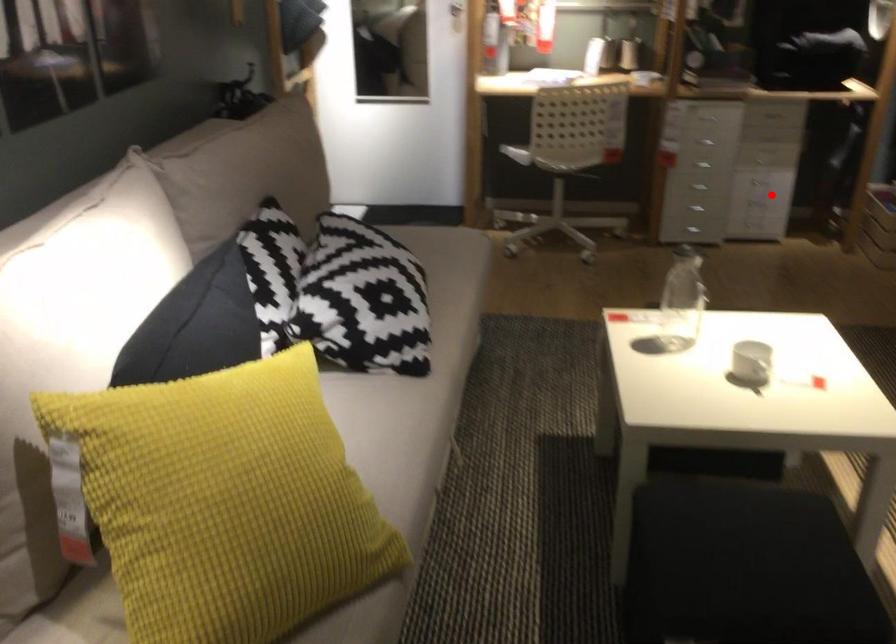
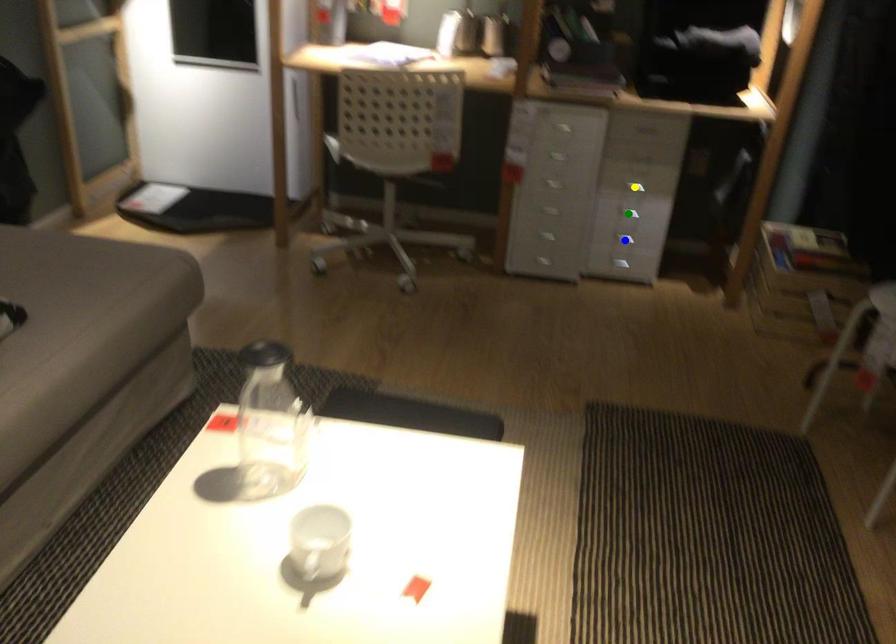
Question: I am providing you with two images of the same scene from different viewpoints. A red point is marked on the first image. You are given multiple points on the second image. Can you choose the point in image 2 that corresponds to the point in image 1?

Choices:
 (A) blue point
 (B) green point
 (C) yellow point

Answer: (A)